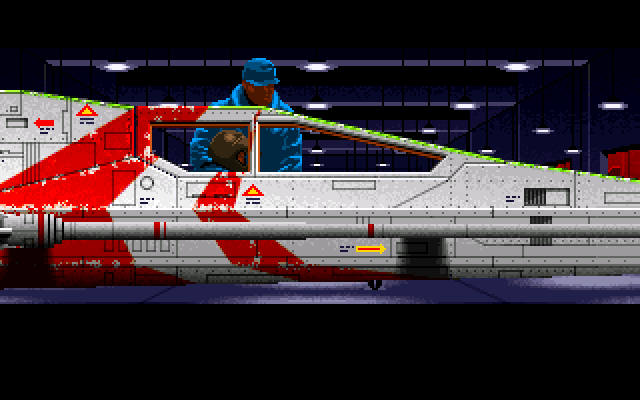
Find the location of a particular element. The image size is (640, 400). led lights is located at coordinates (516, 63), (312, 67), (113, 65), (312, 106).